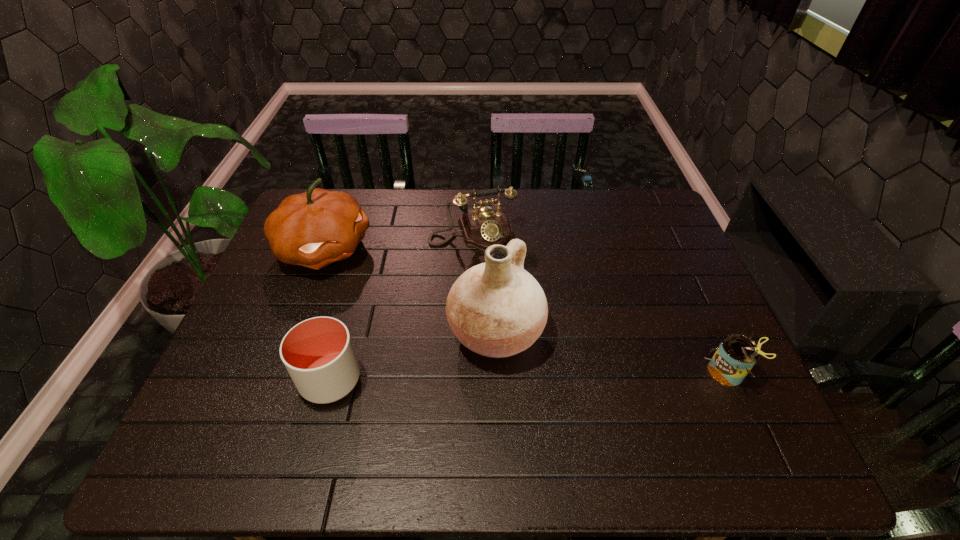
Find the location of a particular element. The width and height of the screenshot is (960, 540). free space between the pumpkin and the telephone is located at coordinates [398, 241].

Locate an element on the screen. empty space between the pumpkin and the pottery is located at coordinates (410, 291).

Identify the location of unoccupied position between the pumpkin and the cup. The image size is (960, 540). tap(327, 314).

Find the location of a particular element. The height and width of the screenshot is (540, 960). vacant area between the can and the telephone is located at coordinates (599, 303).

Find the location of `free space between the can and the cup`. free space between the can and the cup is located at coordinates (528, 376).

You are a GUI agent. You are given a task and a screenshot of the screen. Output one action in this format:
    pyautogui.click(x=<x>, y=<y>)
    Task: Click on the free point between the can and the cup
    The image size is (960, 540).
    Given the screenshot: What is the action you would take?
    pyautogui.click(x=528, y=376)

The width and height of the screenshot is (960, 540). Find the location of `free area in between the second tallest object and the cup`. free area in between the second tallest object and the cup is located at coordinates (327, 314).

At what (x,y) coordinates should I click in order to perform the action: click on the closest object to the pumpkin. Please return your answer as a coordinate pair (x, y). The image size is (960, 540). Looking at the image, I should click on (482, 227).

Identify which object is the fourth nearest to the can. Please provide its 2D coordinates. Your answer should be formatted as a tuple, i.e. [(x, y)], where the tuple contains the x and y coordinates of a point satisfying the conditions above.

[(313, 229)]

This screenshot has width=960, height=540. In order to click on free space that satisfies the following two spatial constraints: 1. on the back side of the cup; 2. on the right side of the can in this screenshot , I will do `click(332, 373)`.